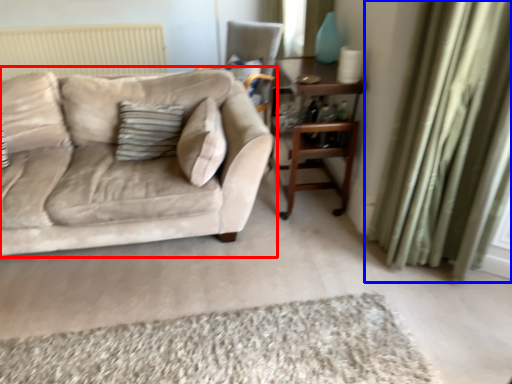
Question: Which point is closer to the camera, studio couch (highlighted by a red box) or curtain (highlighted by a blue box)?

Choices:
 (A) studio couch
 (B) curtain

Answer: (B)